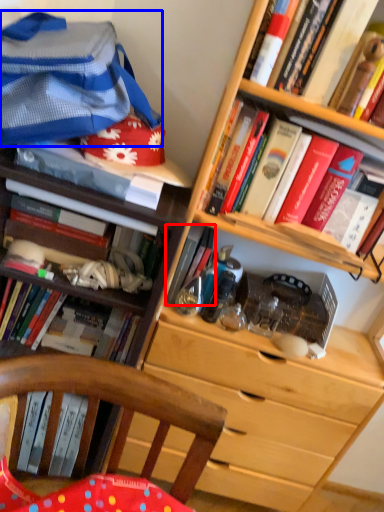
Question: Which object appears farthest to the camera in this image, book (highlighted by a red box) or clothing (highlighted by a blue box)?

Choices:
 (A) book
 (B) clothing

Answer: (A)